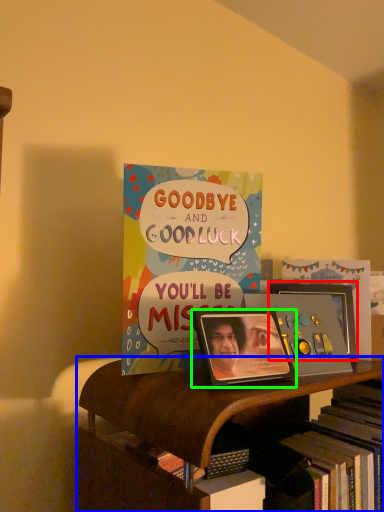
Question: Which object is the closest to the picture frame (highlighted by a red box)? Choose among these: shelf (highlighted by a blue box) or picture frame (highlighted by a green box).

Choices:
 (A) shelf
 (B) picture frame

Answer: (B)